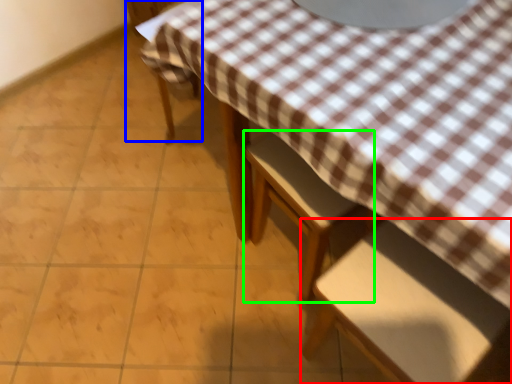
Question: Estimate the real-world distances between objects in this image. Which object is closer to chair (highlighted by a red box), chair (highlighted by a blue box) or chair (highlighted by a green box)?

Choices:
 (A) chair
 (B) chair

Answer: (B)